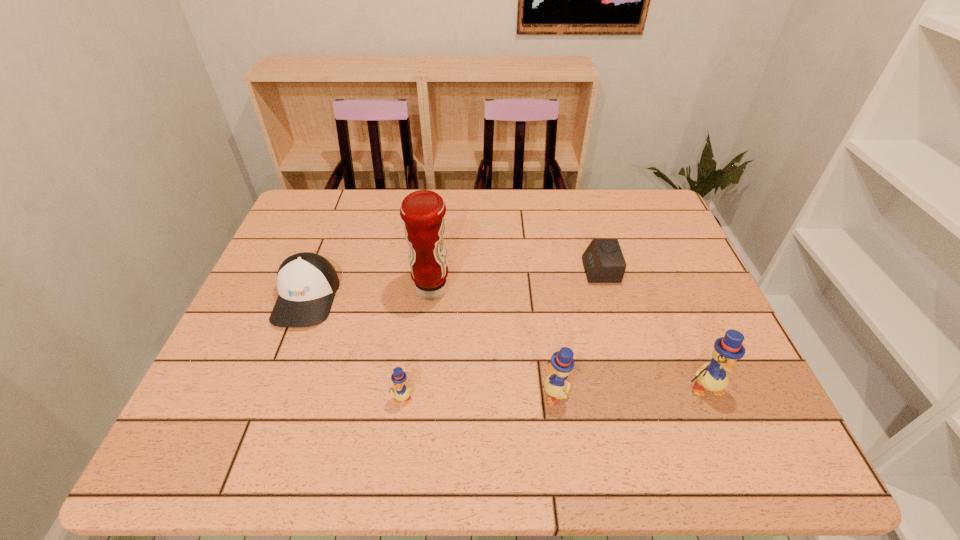
Where is `vacant area that lies between the leftmost duckling and the condiment`? vacant area that lies between the leftmost duckling and the condiment is located at coordinates (417, 344).

Locate an element on the screen. The height and width of the screenshot is (540, 960). vacant region between the shortest duckling and the cap is located at coordinates (354, 348).

This screenshot has height=540, width=960. I want to click on free spot between the second object from right to left and the shortest duckling, so pyautogui.click(x=501, y=334).

Find the location of a particular element. The width and height of the screenshot is (960, 540). free spot between the fourth shortest object and the cap is located at coordinates (431, 345).

Identify which object is located as the third nearest to the leftmost duckling. Please provide its 2D coordinates. Your answer should be formatted as a tuple, i.e. [(x, y)], where the tuple contains the x and y coordinates of a point satisfying the conditions above.

[(562, 363)]

Select which object is the fifth closest to the tallest object. Please provide its 2D coordinates. Your answer should be formatted as a tuple, i.e. [(x, y)], where the tuple contains the x and y coordinates of a point satisfying the conditions above.

[(712, 376)]

Find the location of a particular element. the closest duckling to the condiment is located at coordinates (401, 393).

Identify which duckling is the third nearest to the alarm clock. Please provide its 2D coordinates. Your answer should be formatted as a tuple, i.e. [(x, y)], where the tuple contains the x and y coordinates of a point satisfying the conditions above.

[(401, 393)]

Find the location of a particular element. The image size is (960, 540). free location that satisfies the following two spatial constraints: 1. on the front-facing side of the fifth object from left to right; 2. on the face of the shortest duckling, where the monocle is placed is located at coordinates tap(636, 399).

The width and height of the screenshot is (960, 540). In order to click on vacant point that satisfies the following two spatial constraints: 1. on the front-facing side of the shortest object; 2. on the face of the leftmost duckling, where the monocle is placed in this screenshot , I will do `click(636, 399)`.